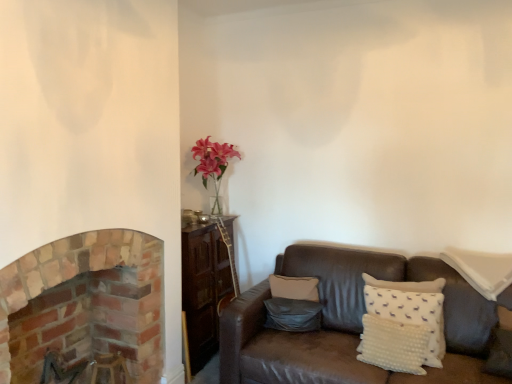
Question: Does white dotted pillow at right, the third pillow positioned from the left, have a lesser height compared to brick fireplace at left?

Choices:
 (A) no
 (B) yes

Answer: (B)

Question: Considering the relative sizes of white dotted pillow at right, which is the first pillow in right-to-left order, and brick fireplace at left in the image provided, is white dotted pillow at right, which is the first pillow in right-to-left order, wider than brick fireplace at left?

Choices:
 (A) yes
 (B) no

Answer: (B)

Question: Considering the relative positions of white dotted pillow at right, which is the first pillow in right-to-left order, and brick fireplace at left in the image provided, is white dotted pillow at right, which is the first pillow in right-to-left order, to the left of brick fireplace at left from the viewer's perspective?

Choices:
 (A) yes
 (B) no

Answer: (B)

Question: Does white dotted pillow at right, the third pillow positioned from the left, come behind brick fireplace at left?

Choices:
 (A) yes
 (B) no

Answer: (A)

Question: Is white dotted pillow at right, the third pillow positioned from the left, positioned in front of brick fireplace at left?

Choices:
 (A) yes
 (B) no

Answer: (B)

Question: Does point (502, 283) appear closer or farther from the camera than point (271, 309)?

Choices:
 (A) closer
 (B) farther

Answer: (A)

Question: In terms of height, does white dotted pillow at right, which is the first pillow in right-to-left order, look taller or shorter compared to matte gray pillow at center, which ranks as the first pillow in left-to-right order?

Choices:
 (A) tall
 (B) short

Answer: (A)

Question: Looking at their shapes, would you say white dotted pillow at right, which is the first pillow in right-to-left order, is wider or thinner than matte gray pillow at center, which is the 3th pillow from right to left?

Choices:
 (A) wide
 (B) thin

Answer: (A)

Question: Would you say white dotted pillow at right, which is the first pillow in right-to-left order, is to the left or to the right of matte gray pillow at center, which ranks as the first pillow in left-to-right order, in the picture?

Choices:
 (A) left
 (B) right

Answer: (B)

Question: In the image, is matte gray pillow at center, which ranks as the first pillow in left-to-right order, positioned in front of or behind white dotted pillow at right, which is the first pillow in right-to-left order?

Choices:
 (A) front
 (B) behind

Answer: (B)

Question: In terms of width, does matte gray pillow at center, which is the 3th pillow from right to left, look wider or thinner when compared to white dotted pillow at right, the third pillow positioned from the left?

Choices:
 (A) thin
 (B) wide

Answer: (A)

Question: From the image's perspective, relative to white dotted pillow at right, which is the first pillow in right-to-left order, is matte gray pillow at center, which is the 3th pillow from right to left, above or below?

Choices:
 (A) below
 (B) above

Answer: (A)

Question: Does point pyautogui.click(x=293, y=301) appear closer or farther from the camera than point pyautogui.click(x=461, y=256)?

Choices:
 (A) farther
 (B) closer

Answer: (A)

Question: Based on their sizes in the image, would you say white dotted pillow at lower right, which is the second pillow in left-to-right order, is bigger or smaller than brick fireplace at left?

Choices:
 (A) small
 (B) big

Answer: (A)

Question: Is white dotted pillow at lower right, which is the second pillow in left-to-right order, spatially inside brick fireplace at left, or outside of it?

Choices:
 (A) inside
 (B) outside

Answer: (B)